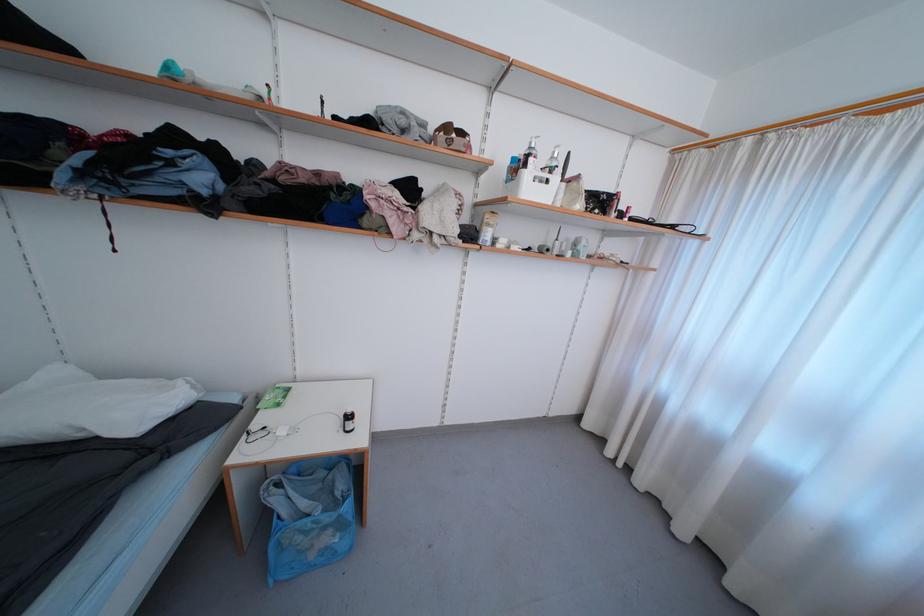
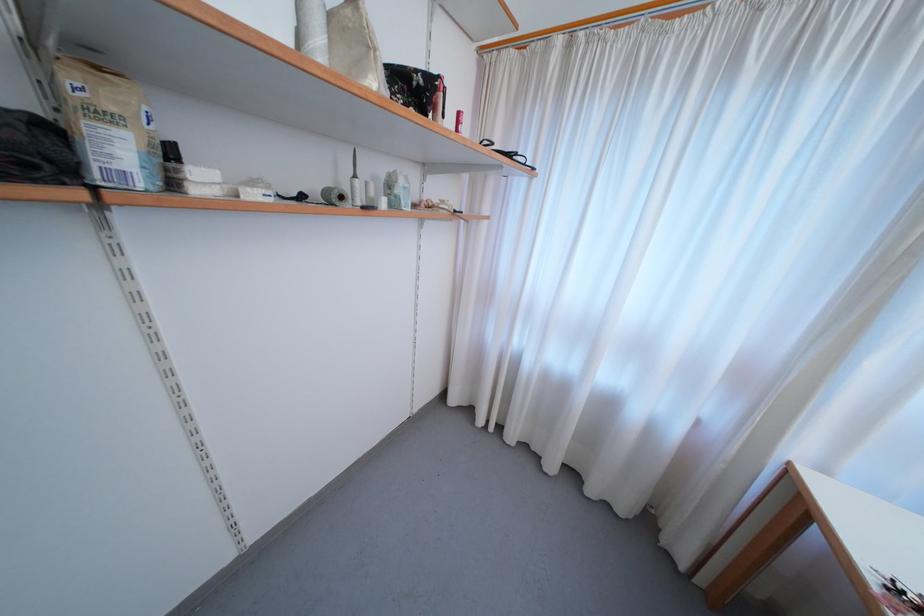
Question: The camera is either moving clockwise (left) or counter-clockwise (right) around the object. The first image is from the beginning of the video and the second image is from the end. Is the camera moving left or right when shooting the video?

Choices:
 (A) Left
 (B) Right

Answer: (A)